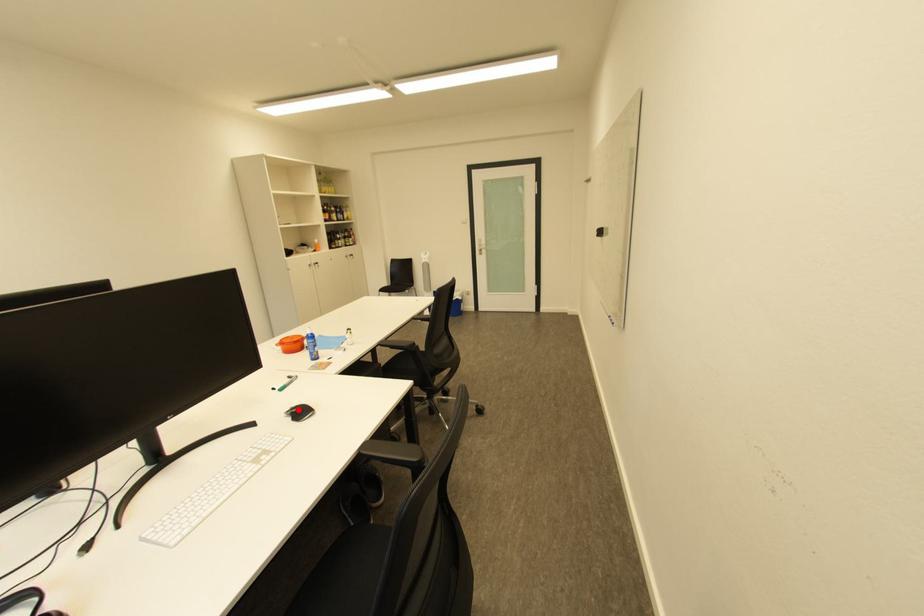
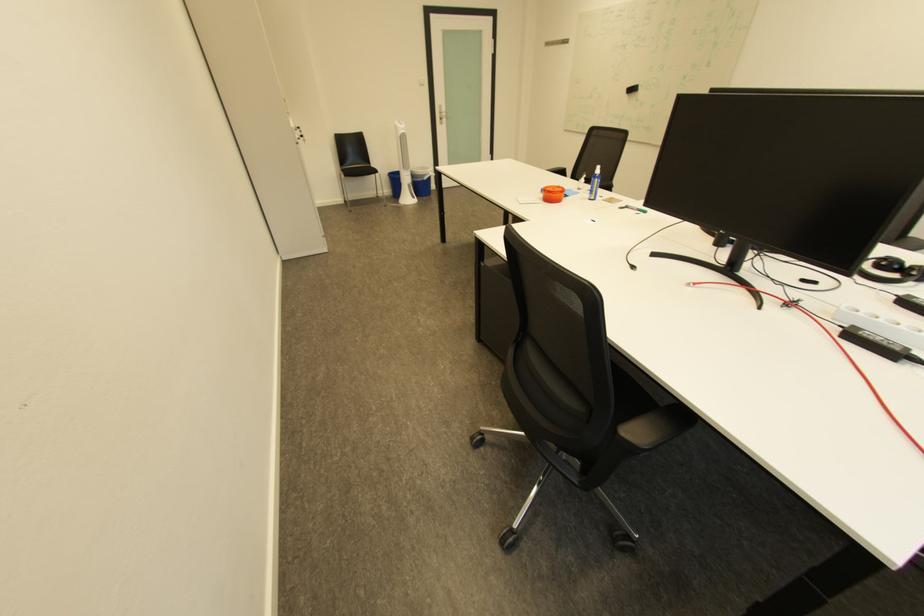
Question: I am providing you with two images of the same scene from different viewpoints. A red point is marked on the first image. Is the red point's position out of view in image 2?

Choices:
 (A) Yes
 (B) No

Answer: (A)